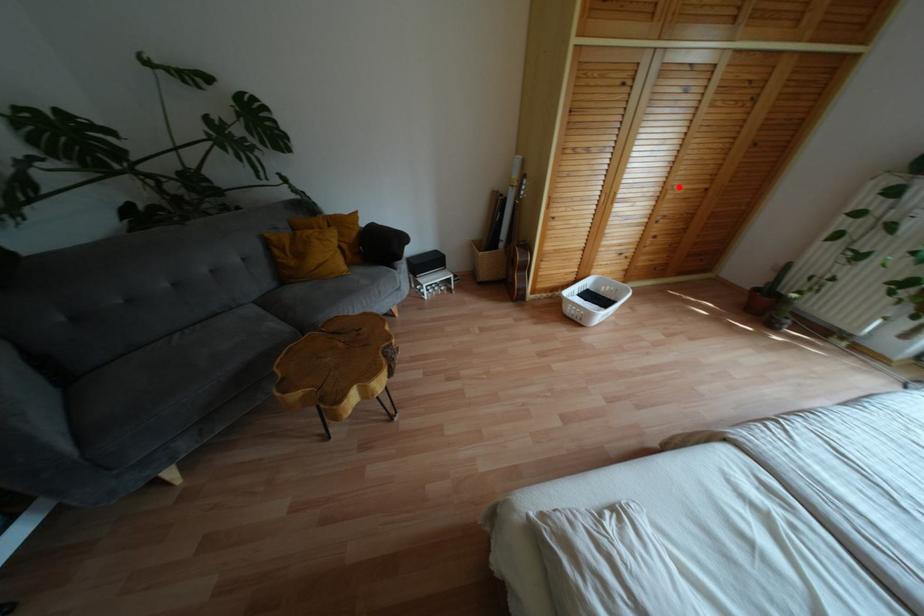
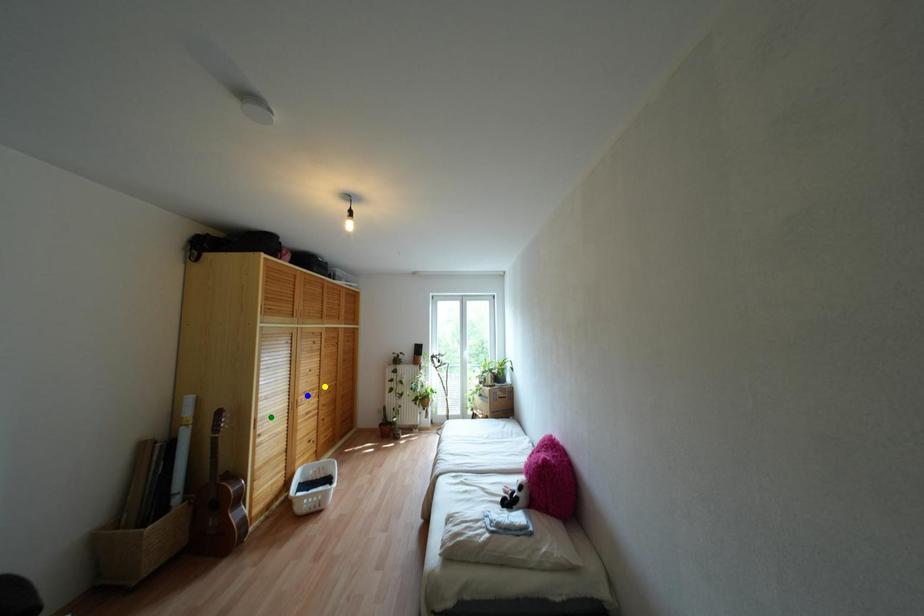
Question: I am providing you with two images of the same scene from different viewpoints. A red point is marked on the first image. You are given multiple points on the second image. Which spot in image 2 lines up with the point in image 1?

Choices:
 (A) blue point
 (B) green point
 (C) yellow point

Answer: (C)